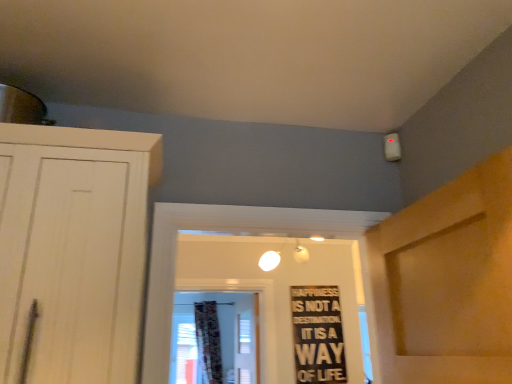
The image size is (512, 384). Describe the element at coordinates (318, 335) in the screenshot. I see `black matte signboard at center` at that location.

Where is `black matte signboard at center`? This screenshot has width=512, height=384. black matte signboard at center is located at coordinates (318, 335).

Image resolution: width=512 pixels, height=384 pixels. What do you see at coordinates (208, 341) in the screenshot?
I see `floral fabric curtain at center` at bounding box center [208, 341].

You are a GUI agent. You are given a task and a screenshot of the screen. Output one action in this format:
    pyautogui.click(x=<x>, y=<y>)
    Task: Click on the floral fabric curtain at center
    This screenshot has width=512, height=384.
    Given the screenshot: What is the action you would take?
    pyautogui.click(x=208, y=341)

Where is `black matte signboard at center`? This screenshot has width=512, height=384. black matte signboard at center is located at coordinates (318, 335).

Considering the relative positions of black matte signboard at center and floral fabric curtain at center in the image provided, is black matte signboard at center to the left or to the right of floral fabric curtain at center?

black matte signboard at center is to the right of floral fabric curtain at center.

Based on the photo, in the image, is black matte signboard at center positioned in front of or behind floral fabric curtain at center?

black matte signboard at center is in front of floral fabric curtain at center.

Does point (329, 365) appear closer or farther from the camera than point (211, 382)?

Point (329, 365) appears to be closer to the viewer than point (211, 382).

From the image's perspective, between black matte signboard at center and floral fabric curtain at center, who is located below?

floral fabric curtain at center is shown below in the image.

From a real-world perspective, is black matte signboard at center located higher than floral fabric curtain at center?

Actually, black matte signboard at center is physically below floral fabric curtain at center in the real world.

Looking at their sizes, would you say black matte signboard at center is wider or thinner than floral fabric curtain at center?

Considering their sizes, black matte signboard at center looks slimmer than floral fabric curtain at center.

Who is shorter, black matte signboard at center or floral fabric curtain at center?

black matte signboard at center.

Considering the relative sizes of black matte signboard at center and floral fabric curtain at center in the image provided, is black matte signboard at center smaller than floral fabric curtain at center?

Indeed, black matte signboard at center has a smaller size compared to floral fabric curtain at center.

Is black matte signboard at center not inside floral fabric curtain at center?

black matte signboard at center is positioned outside floral fabric curtain at center.

Is black matte signboard at center with floral fabric curtain at center?

black matte signboard at center is not next to floral fabric curtain at center, and they're not touching.

Is black matte signboard at center looking in the opposite direction of floral fabric curtain at center?

Absolutely, black matte signboard at center is directed away from floral fabric curtain at center.

What's the angular difference between black matte signboard at center and floral fabric curtain at center's facing directions?

0.645 degrees separate the facing orientations of black matte signboard at center and floral fabric curtain at center.

How far apart are black matte signboard at center and floral fabric curtain at center?

They are 4.90 feet apart.

Identify the location of curtain behind the black matte signboard at center. (208, 341).

Which is more to the left, floral fabric curtain at center or black matte signboard at center?

floral fabric curtain at center.

In the scene shown: Is floral fabric curtain at center closer to camera compared to black matte signboard at center?

That is False.

Is point (211, 381) in front of point (305, 296)?

That is False.

From the image's perspective, which is below, floral fabric curtain at center or black matte signboard at center?

floral fabric curtain at center appears lower in the image.

From a real-world perspective, is floral fabric curtain at center physically located above or below black matte signboard at center?

From a real-world perspective, floral fabric curtain at center is physically above black matte signboard at center.

Considering the sizes of objects floral fabric curtain at center and black matte signboard at center in the image provided, who is thinner, floral fabric curtain at center or black matte signboard at center?

black matte signboard at center.

Considering the sizes of objects floral fabric curtain at center and black matte signboard at center in the image provided, who is taller, floral fabric curtain at center or black matte signboard at center?

Standing taller between the two is floral fabric curtain at center.

Does floral fabric curtain at center have a smaller size compared to black matte signboard at center?

Incorrect, floral fabric curtain at center is not smaller in size than black matte signboard at center.

Looking at this image, is floral fabric curtain at center not inside black matte signboard at center?

Indeed, floral fabric curtain at center is completely outside black matte signboard at center.

Is floral fabric curtain at center not near black matte signboard at center?

That's right, there is a large distance between floral fabric curtain at center and black matte signboard at center.

Is floral fabric curtain at center facing towards black matte signboard at center?

Yes, floral fabric curtain at center is aimed at black matte signboard at center.

Can you tell me how much floral fabric curtain at center and black matte signboard at center differ in facing direction?

There is a 0.645-degree angle between the facing directions of floral fabric curtain at center and black matte signboard at center.

How far apart are floral fabric curtain at center and black matte signboard at center?

They are 4.90 feet apart.

Where is `curtain below the black matte signboard at center (from the image's perspective)`? The height and width of the screenshot is (384, 512). curtain below the black matte signboard at center (from the image's perspective) is located at coordinates (208, 341).

At what (x,y) coordinates should I click in order to perform the action: click on curtain on the left of black matte signboard at center. Please return your answer as a coordinate pair (x, y). The height and width of the screenshot is (384, 512). Looking at the image, I should click on (208, 341).

Identify the location of curtain below the black matte signboard at center (from the image's perspective). (208, 341).